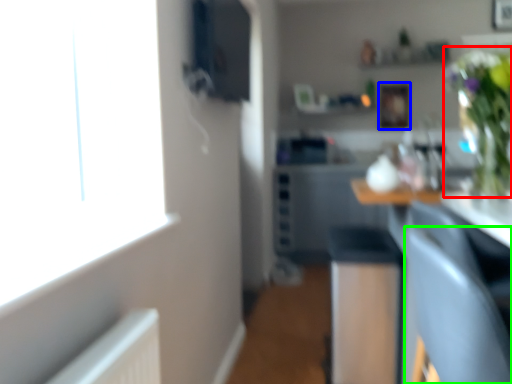
Question: Which object is positioned closest to floral arrangement (highlighted by a red box)? Select from picture frame (highlighted by a blue box) and armchair (highlighted by a green box).

Choices:
 (A) picture frame
 (B) armchair

Answer: (B)